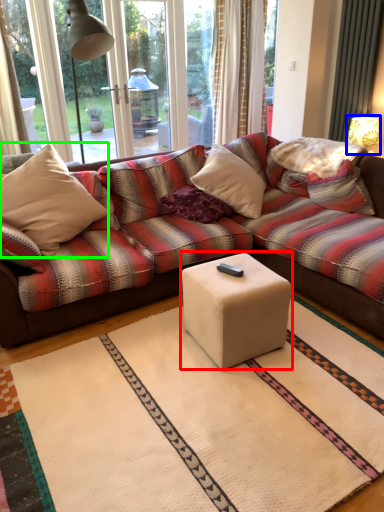
Question: Based on their relative distances, which object is farther from coffee table (highlighted by a red box)? Choose from table lamp (highlighted by a blue box) and throw pillow (highlighted by a green box).

Choices:
 (A) table lamp
 (B) throw pillow

Answer: (A)